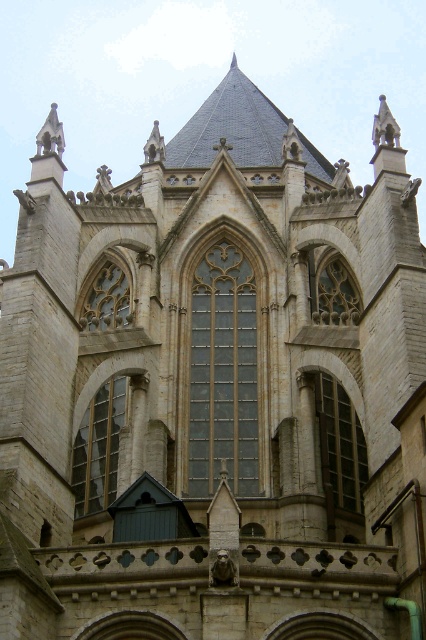
Question: Estimate the real-world distances between objects in this image. Which object is farther from the clear glass window at center?

Choices:
 (A) clear glass window at upper center
 (B) clear glass window at center-right
 (C) transparent glass window at center

Answer: (A)

Question: In this image, where is transparent glass window at center located relative to clear glass window at center-right?

Choices:
 (A) above
 (B) below

Answer: (B)

Question: Does clear glass window at center appear under transparent glass window at center?

Choices:
 (A) yes
 (B) no

Answer: (B)

Question: Estimate the real-world distances between objects in this image. Which object is farther from the clear glass window at center?

Choices:
 (A) clear glass window at upper center
 (B) clear glass window at center-right
 (C) transparent glass window at center

Answer: (A)

Question: Estimate the real-world distances between objects in this image. Which object is farther from the clear glass window at center-right?

Choices:
 (A) transparent glass window at center
 (B) clear glass window at upper center
 (C) clear glass window at center

Answer: (B)

Question: Can you confirm if clear glass window at center-right is positioned to the left of clear glass window at upper center?

Choices:
 (A) yes
 (B) no

Answer: (B)